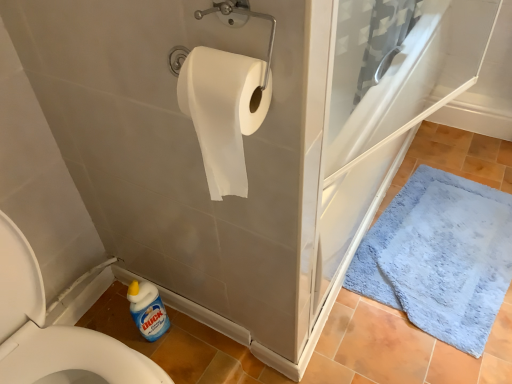
Question: Considering the relative sizes of white matte toilet paper at upper center and blue plush bath mat at lower right in the image provided, is white matte toilet paper at upper center thinner than blue plush bath mat at lower right?

Choices:
 (A) yes
 (B) no

Answer: (A)

Question: From the image's perspective, does white matte toilet paper at upper center appear higher than blue plush bath mat at lower right?

Choices:
 (A) yes
 (B) no

Answer: (A)

Question: Is white matte toilet paper at upper center smaller than blue plush bath mat at lower right?

Choices:
 (A) no
 (B) yes

Answer: (B)

Question: Is white matte toilet paper at upper center positioned beyond the bounds of blue plush bath mat at lower right?

Choices:
 (A) no
 (B) yes

Answer: (B)

Question: Is white matte toilet paper at upper center positioned behind blue plush bath mat at lower right?

Choices:
 (A) yes
 (B) no

Answer: (B)

Question: Does white matte toilet paper at upper center have a greater width compared to blue plush bath mat at lower right?

Choices:
 (A) no
 (B) yes

Answer: (A)

Question: Does white paper towel at left lie in front of blue plush bath mat at lower right?

Choices:
 (A) yes
 (B) no

Answer: (A)

Question: Considering the relative positions of white paper towel at left and blue plush bath mat at lower right in the image provided, is white paper towel at left to the right of blue plush bath mat at lower right from the viewer's perspective?

Choices:
 (A) no
 (B) yes

Answer: (A)

Question: Is white paper towel at left shorter than blue plush bath mat at lower right?

Choices:
 (A) no
 (B) yes

Answer: (A)

Question: Is white paper towel at left behind blue plush bath mat at lower right?

Choices:
 (A) no
 (B) yes

Answer: (A)

Question: From the image's perspective, is white paper towel at left above blue plush bath mat at lower right?

Choices:
 (A) yes
 (B) no

Answer: (B)

Question: Is white paper towel at left at the left side of blue plush bath mat at lower right?

Choices:
 (A) no
 (B) yes

Answer: (B)

Question: Is white matte toilet paper at upper center in contact with white paper towel at left?

Choices:
 (A) no
 (B) yes

Answer: (A)